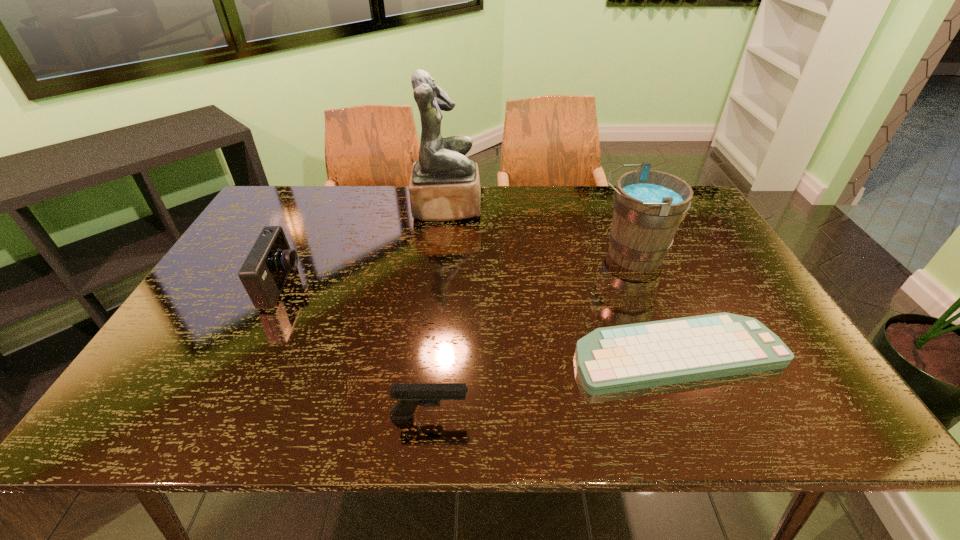
The height and width of the screenshot is (540, 960). Identify the location of vacant region that satisfies the following two spatial constraints: 1. in a relaxed pose on the tallest object; 2. on the right side of the fourth farthest object. (432, 355).

I want to click on free space that satisfies the following two spatial constraints: 1. in a relaxed pose on the computer keyboard; 2. on the left side of the sculpture, so click(x=432, y=355).

This screenshot has width=960, height=540. Find the location of `free space that satisfies the following two spatial constraints: 1. on the front-facing side of the second nearest object; 2. on the left side of the camera`. free space that satisfies the following two spatial constraints: 1. on the front-facing side of the second nearest object; 2. on the left side of the camera is located at coordinates (247, 355).